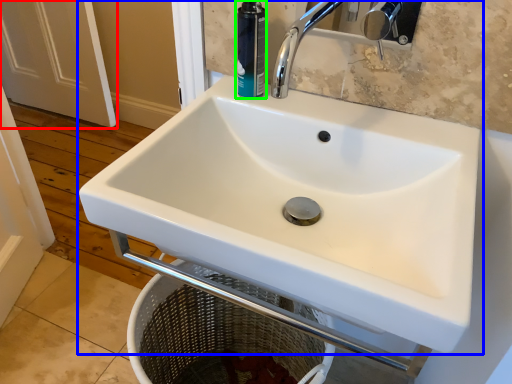
Question: Which is nearer to the screen door (highlighted by a red box)? sink (highlighted by a blue box) or toiletry (highlighted by a green box).

Choices:
 (A) sink
 (B) toiletry

Answer: (A)